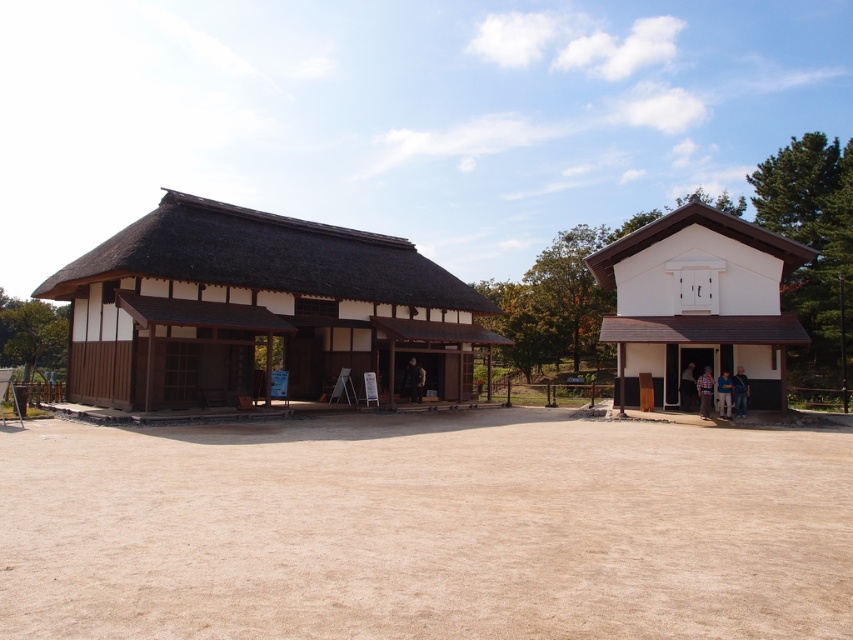
Question: Which point is farther to the camera?

Choices:
 (A) brown sandy dirt field at center
 (B) white matte house at right
 (C) wooden thatched roof hut at center

Answer: (B)

Question: Is wooden thatched roof hut at center below white matte house at right?

Choices:
 (A) no
 (B) yes

Answer: (A)

Question: Which point is closer to the camera?

Choices:
 (A) (700, 474)
 (B) (685, 296)
 (C) (33, 291)

Answer: (A)

Question: Does brown sandy dirt field at center appear under wooden thatched roof hut at center?

Choices:
 (A) no
 (B) yes

Answer: (B)

Question: Which object is positioned farthest from the brown sandy dirt field at center?

Choices:
 (A) wooden thatched roof hut at center
 (B) white matte house at right

Answer: (B)

Question: Can you confirm if wooden thatched roof hut at center is bigger than white matte house at right?

Choices:
 (A) no
 (B) yes

Answer: (B)